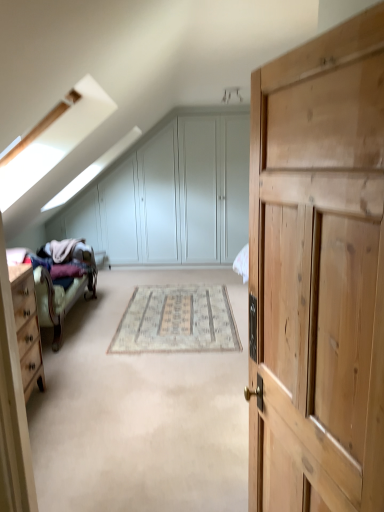
Locate an element on the screen. The height and width of the screenshot is (512, 384). vacant point to the right of light wood dresser at left is located at coordinates (87, 441).